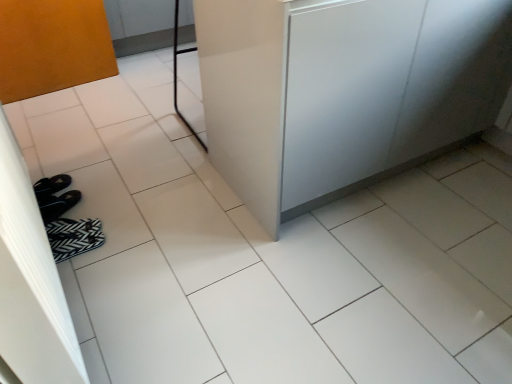
I want to click on matte orange screen door at left, so click(x=31, y=282).

Does satin white counter at center have a lesser height compared to black fabric flip-flops at lower left?

No.

Does satin white counter at center appear on the left side of black fabric flip-flops at lower left?

Incorrect, satin white counter at center is not on the left side of black fabric flip-flops at lower left.

Is satin white counter at center oriented towards black fabric flip-flops at lower left?

No, satin white counter at center does not turn towards black fabric flip-flops at lower left.

Is black fabric flip-flops at lower left facing away from matte orange screen door at left?

Yes, black fabric flip-flops at lower left is positioned with its back facing matte orange screen door at left.

Is black fabric flip-flops at lower left bigger than matte orange screen door at left?

No, black fabric flip-flops at lower left is not bigger than matte orange screen door at left.

From the image's perspective, is black fabric flip-flops at lower left above or below matte orange screen door at left?

Based on their image positions, black fabric flip-flops at lower left is located beneath matte orange screen door at left.

Does black fabric flip-flops at lower left have a greater width compared to matte orange screen door at left?

Correct, the width of black fabric flip-flops at lower left exceeds that of matte orange screen door at left.

Is black fabric flip-flops at lower left bigger or smaller than satin white counter at center?

Considering their sizes, black fabric flip-flops at lower left takes up less space than satin white counter at center.

Is point (64, 232) closer to viewer compared to point (318, 81)?

No, (64, 232) is behind (318, 81).

Considering the positions of objects black fabric flip-flops at lower left and satin white counter at center in the image provided, who is more to the right, black fabric flip-flops at lower left or satin white counter at center?

satin white counter at center is more to the right.

Is black fabric flip-flops at lower left taller or shorter than satin white counter at center?

Clearly, black fabric flip-flops at lower left is shorter compared to satin white counter at center.

Is matte orange screen door at left inside the boundaries of satin white counter at center, or outside?

matte orange screen door at left is outside satin white counter at center.

From the image's perspective, is matte orange screen door at left positioned above or below satin white counter at center?

matte orange screen door at left is situated lower than satin white counter at center in the image.

Can you see matte orange screen door at left touching satin white counter at center?

No, matte orange screen door at left is not touching satin white counter at center.

Between matte orange screen door at left and satin white counter at center, which one has smaller width?

matte orange screen door at left.

Considering the points (8, 131) and (73, 241), which point is behind, point (8, 131) or point (73, 241)?

The point (73, 241) is more distant.

Is matte orange screen door at left positioned far away from black fabric flip-flops at lower left?

That's not correct — matte orange screen door at left is a little close to black fabric flip-flops at lower left.

Can black fabric flip-flops at lower left be found inside matte orange screen door at left?

No, black fabric flip-flops at lower left is not inside matte orange screen door at left.

Does matte orange screen door at left appear on the left side of black fabric flip-flops at lower left?

Yes.

Does satin white counter at center turn towards matte orange screen door at left?

No, satin white counter at center is not aimed at matte orange screen door at left.

Can you confirm if satin white counter at center is positioned to the right of matte orange screen door at left?

Indeed, satin white counter at center is positioned on the right side of matte orange screen door at left.

Measure the distance from satin white counter at center to matte orange screen door at left.

satin white counter at center is 1.01 meters from matte orange screen door at left.

From a real-world perspective, is satin white counter at center beneath matte orange screen door at left?

Actually, satin white counter at center is physically above matte orange screen door at left in the real world.

Find the location of a particular element. counter in front of the black fabric flip-flops at lower left is located at coordinates (343, 88).

Locate an element on the screen. The width and height of the screenshot is (512, 384). screen door on the left of black fabric flip-flops at lower left is located at coordinates (31, 282).

Looking at the image, which one is located further to black fabric flip-flops at lower left, satin white counter at center or matte orange screen door at left?

satin white counter at center is positioned further to the anchor black fabric flip-flops at lower left.

Based on their spatial positions, is satin white counter at center or black fabric flip-flops at lower left closer to matte orange screen door at left?

The object closer to matte orange screen door at left is black fabric flip-flops at lower left.

Estimate the real-world distances between objects in this image. Which object is further from matte orange screen door at left, black fabric flip-flops at lower left or satin white counter at center?

satin white counter at center is positioned further to the anchor matte orange screen door at left.

Considering their positions, is matte orange screen door at left positioned closer to black fabric flip-flops at lower left than satin white counter at center?

Based on the image, matte orange screen door at left appears to be nearer to black fabric flip-flops at lower left.

Looking at the image, which one is located closer to satin white counter at center, matte orange screen door at left or black fabric flip-flops at lower left?

matte orange screen door at left is positioned closer to the anchor satin white counter at center.

Estimate the real-world distances between objects in this image. Which object is closer to satin white counter at center, black fabric flip-flops at lower left or matte orange screen door at left?

matte orange screen door at left is positioned closer to the anchor satin white counter at center.

The height and width of the screenshot is (384, 512). In order to click on footwear located between matte orange screen door at left and satin white counter at center in the left-right direction in this screenshot , I will do `click(74, 237)`.